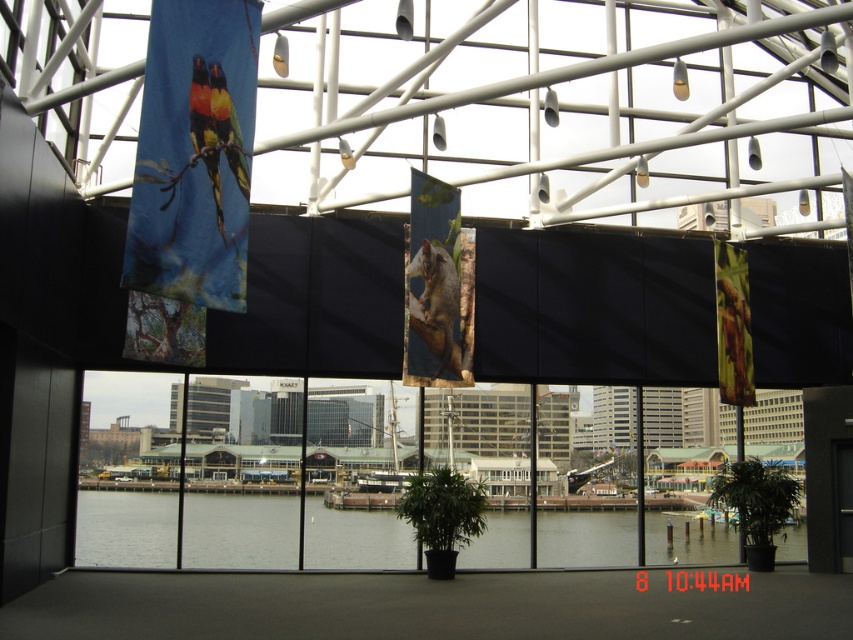
You are standing in the room and want to touch the blue fabric birds at left and the clear water at lower center. Which object will you reach first?

The blue fabric birds at left is closer to the viewer than the clear water at lower center, so you will reach the blue fabric birds at left first.

You are standing in the room and want to take a photo of the blue fabric birds at left without the multicolored fabric parrot at upper left appearing in the background. Is this possible?

The blue fabric birds at left is in front of the multicolored fabric parrot at upper left, so you can take a photo of the blue fabric birds at left without the multicolored fabric parrot at upper left appearing in the background by positioning yourself so that the parrot is out of the frame or obscured.